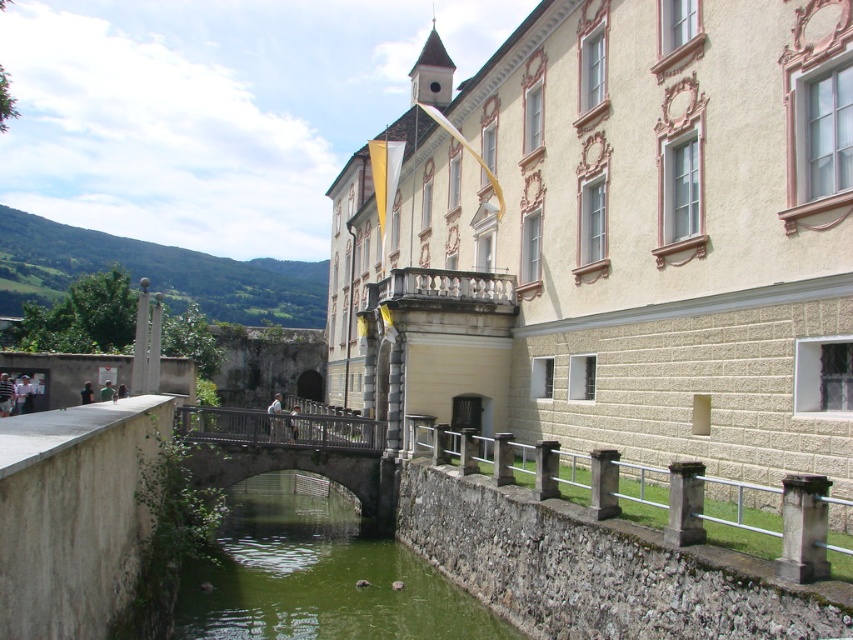
Question: Is stone/rustic fence at lower right below wooden bridge at center?

Choices:
 (A) yes
 (B) no

Answer: (B)

Question: Is green stone river at center further to camera compared to stone/rustic fence at lower right?

Choices:
 (A) no
 (B) yes

Answer: (B)

Question: Where is green stone river at center located in relation to wooden bridge at center in the image?

Choices:
 (A) left
 (B) right

Answer: (B)

Question: Among these objects, which one is nearest to the camera?

Choices:
 (A) stone/rustic fence at lower right
 (B) green stone river at center
 (C) wooden bridge at center

Answer: (A)

Question: Which of the following is the farthest from the observer?

Choices:
 (A) (339, 496)
 (B) (250, 474)
 (C) (422, 445)

Answer: (A)

Question: Which object appears closest to the camera in this image?

Choices:
 (A) green stone river at center
 (B) stone/rustic fence at lower right
 (C) wooden bridge at center

Answer: (B)